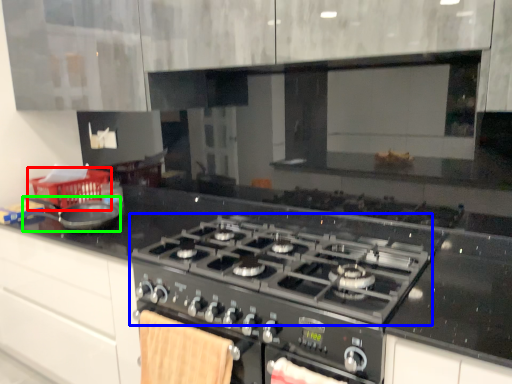
Question: Which is farther away from basket (highlighted by a red box)? gas stove (highlighted by a blue box) or kitchen appliance (highlighted by a green box)?

Choices:
 (A) gas stove
 (B) kitchen appliance

Answer: (A)